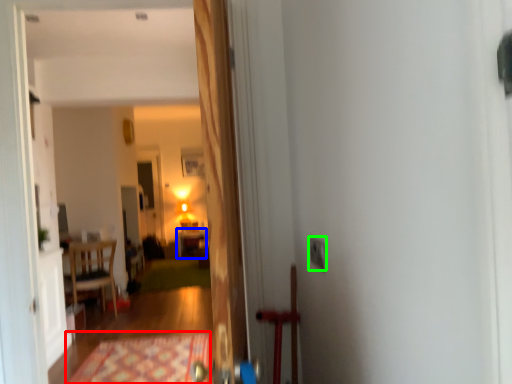
Question: Which object is the farthest from doormat (highlighted by a red box)? Choose among these: table (highlighted by a blue box) or electric outlet (highlighted by a green box).

Choices:
 (A) table
 (B) electric outlet

Answer: (A)